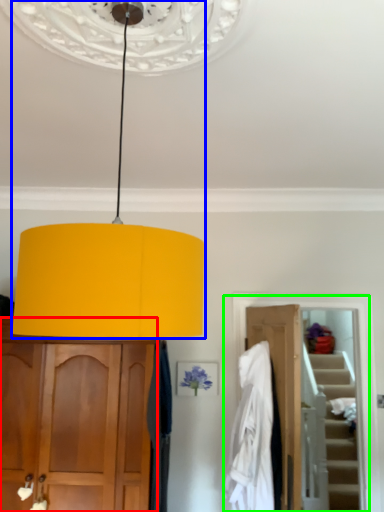
Question: Which object is positioned closest to cabinetry (highlighted by a red box)? Select from lamp (highlighted by a blue box) and closet (highlighted by a green box).

Choices:
 (A) lamp
 (B) closet

Answer: (B)